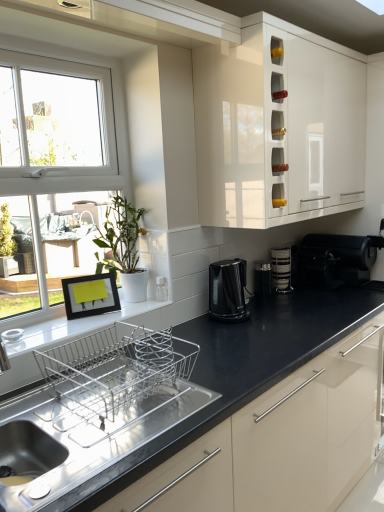
Question: Considering the relative sizes of stacked plates at center and black plastic toaster at center, the 2th appliance when ordered from right to left, in the image provided, is stacked plates at center thinner than black plastic toaster at center, the 2th appliance when ordered from right to left,?

Choices:
 (A) yes
 (B) no

Answer: (A)

Question: From the image's perspective, does stacked plates at center appear higher than black plastic toaster at center, placed as the first appliance when sorted from back to front?

Choices:
 (A) no
 (B) yes

Answer: (B)

Question: Is stacked plates at center positioned before black plastic toaster at center, which appears as the second appliance when viewed from the left?

Choices:
 (A) no
 (B) yes

Answer: (A)

Question: From a real-world perspective, is stacked plates at center positioned over black plastic toaster at center, which appears as the second appliance when viewed from the left, based on gravity?

Choices:
 (A) yes
 (B) no

Answer: (A)

Question: From the image's perspective, is stacked plates at center beneath black plastic toaster at center, which appears as the second appliance when viewed from the left?

Choices:
 (A) no
 (B) yes

Answer: (A)

Question: Is stacked plates at center wider than black plastic toaster at center, the third appliance in the front-to-back sequence?

Choices:
 (A) yes
 (B) no

Answer: (B)

Question: Considering the relative sizes of stainless steel sink at lower left and green leafy plant at left in the image provided, is stainless steel sink at lower left shorter than green leafy plant at left?

Choices:
 (A) yes
 (B) no

Answer: (A)

Question: From a real-world perspective, is stainless steel sink at lower left below green leafy plant at left?

Choices:
 (A) no
 (B) yes

Answer: (B)

Question: From the image's perspective, is stainless steel sink at lower left above green leafy plant at left?

Choices:
 (A) yes
 (B) no

Answer: (B)

Question: Does stainless steel sink at lower left touch green leafy plant at left?

Choices:
 (A) no
 (B) yes

Answer: (A)

Question: Does stainless steel sink at lower left have a greater width compared to green leafy plant at left?

Choices:
 (A) yes
 (B) no

Answer: (A)

Question: Does stainless steel sink at lower left appear on the right side of green leafy plant at left?

Choices:
 (A) no
 (B) yes

Answer: (A)

Question: Is white glossy cabinet at upper center not within black plastic toaster at right, which is the second appliance from back to front?

Choices:
 (A) yes
 (B) no

Answer: (A)